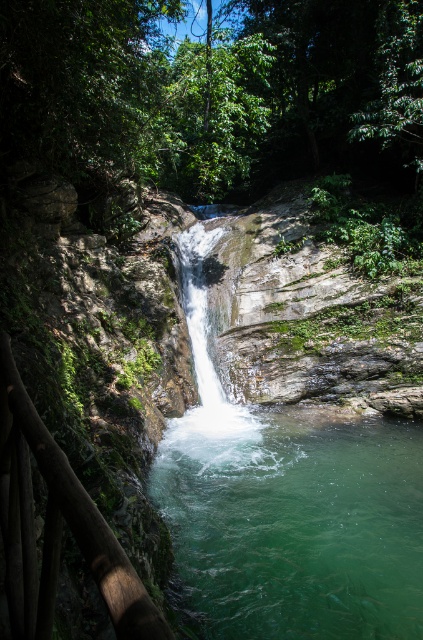
Question: Is green translucent water at center smaller than clear water at center?

Choices:
 (A) no
 (B) yes

Answer: (B)

Question: Where is green translucent water at center located in relation to clear water at center in the image?

Choices:
 (A) below
 (B) above

Answer: (A)

Question: Is green translucent water at center to the left of clear water at center from the viewer's perspective?

Choices:
 (A) yes
 (B) no

Answer: (B)

Question: Among these objects, which one is nearest to the camera?

Choices:
 (A) clear water at center
 (B) green translucent water at center

Answer: (B)